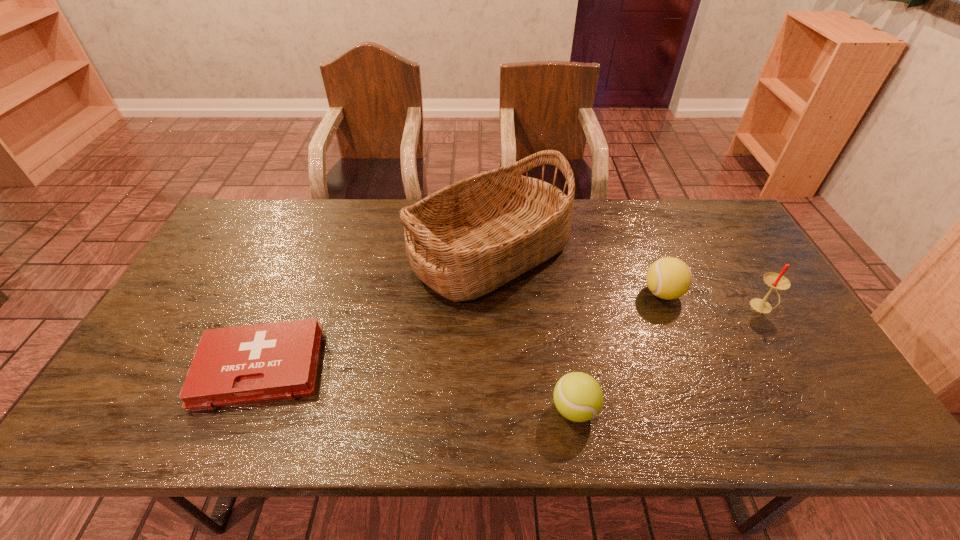
Locate an element on the screen. vacant space at the near edge of the desktop is located at coordinates (376, 411).

You are a GUI agent. You are given a task and a screenshot of the screen. Output one action in this format:
    pyautogui.click(x=<x>, y=<y>)
    Task: Click on the vacant region at the right edge of the desktop
    The height and width of the screenshot is (540, 960).
    Given the screenshot: What is the action you would take?
    pyautogui.click(x=745, y=252)

At what (x,y) coordinates should I click in order to perform the action: click on vacant region at the far left corner of the desktop. Please return your answer as a coordinate pair (x, y). Looking at the image, I should click on (228, 242).

In the image, there is a desktop. Identify the location of vacant area at the far right corner. (708, 225).

The height and width of the screenshot is (540, 960). Identify the location of vacant point located between the first-aid kit and the right tennis ball. [462, 330].

Find the location of `empty space between the fourth shortest object and the farther tennis ball`. empty space between the fourth shortest object and the farther tennis ball is located at coordinates click(x=712, y=301).

Find the location of a particular element. This screenshot has width=960, height=540. vacant area that lies between the right tennis ball and the first-aid kit is located at coordinates click(x=462, y=330).

Image resolution: width=960 pixels, height=540 pixels. I want to click on free space between the nearer tennis ball and the fourth shortest object, so click(668, 359).

Locate an element on the screen. The image size is (960, 540). free space between the first-aid kit and the tallest object is located at coordinates (375, 310).

Where is `empty location between the fourth shortest object and the nearer tennis ball`? empty location between the fourth shortest object and the nearer tennis ball is located at coordinates (668, 359).